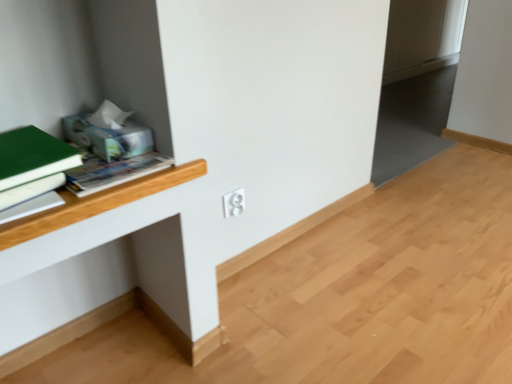
Question: Does white plastic electric outlet at center have a smaller size compared to white matte book at left?

Choices:
 (A) no
 (B) yes

Answer: (B)

Question: Is white plastic electric outlet at center bigger than white matte book at left?

Choices:
 (A) yes
 (B) no

Answer: (B)

Question: Does white plastic electric outlet at center lie in front of white matte book at left?

Choices:
 (A) yes
 (B) no

Answer: (B)

Question: Is white plastic electric outlet at center positioned with its back to white matte book at left?

Choices:
 (A) yes
 (B) no

Answer: (B)

Question: Does white plastic electric outlet at center appear on the left side of white matte book at left?

Choices:
 (A) no
 (B) yes

Answer: (A)

Question: Considering the positions of white plastic electric outlet at center and white matte computer desk at center in the image, is white plastic electric outlet at center taller or shorter than white matte computer desk at center?

Choices:
 (A) short
 (B) tall

Answer: (B)

Question: Looking at their shapes, would you say white plastic electric outlet at center is wider or thinner than white matte computer desk at center?

Choices:
 (A) wide
 (B) thin

Answer: (A)

Question: From the image's perspective, is white plastic electric outlet at center located above or below white matte computer desk at center?

Choices:
 (A) above
 (B) below

Answer: (A)

Question: From a real-world perspective, is white plastic electric outlet at center above or below white matte computer desk at center?

Choices:
 (A) below
 (B) above

Answer: (B)

Question: Considering the positions of white matte book at left and white plastic electric outlet at center in the image, is white matte book at left taller or shorter than white plastic electric outlet at center?

Choices:
 (A) tall
 (B) short

Answer: (B)

Question: From the image's perspective, is white matte book at left above or below white plastic electric outlet at center?

Choices:
 (A) below
 (B) above

Answer: (B)

Question: Is white matte book at left in front of or behind white plastic electric outlet at center in the image?

Choices:
 (A) front
 (B) behind

Answer: (A)

Question: In terms of size, does white matte book at left appear bigger or smaller than white plastic electric outlet at center?

Choices:
 (A) big
 (B) small

Answer: (A)

Question: From the image's perspective, is green matte book at left positioned above or below white matte book at left?

Choices:
 (A) below
 (B) above

Answer: (B)

Question: Is green matte book at left inside or outside of white matte book at left?

Choices:
 (A) inside
 (B) outside

Answer: (B)